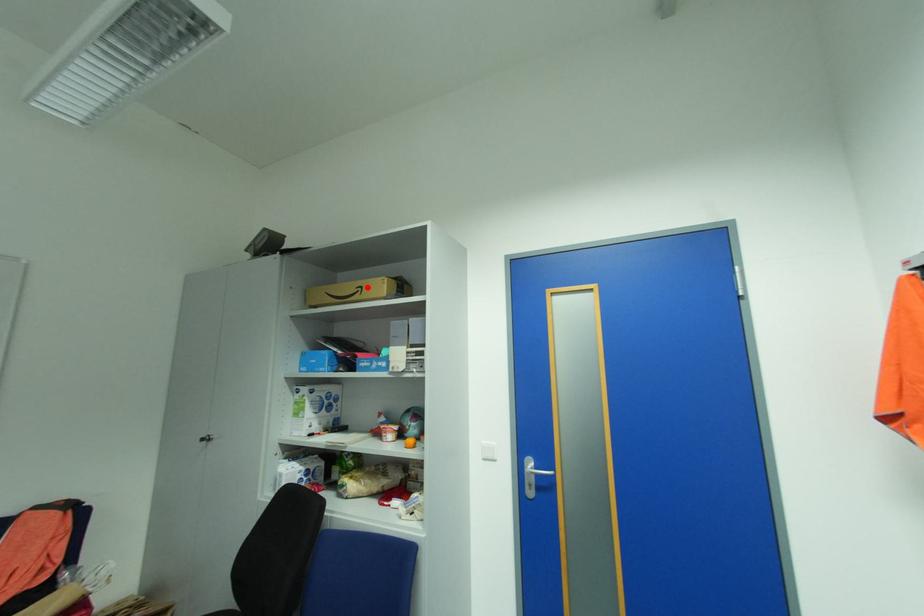
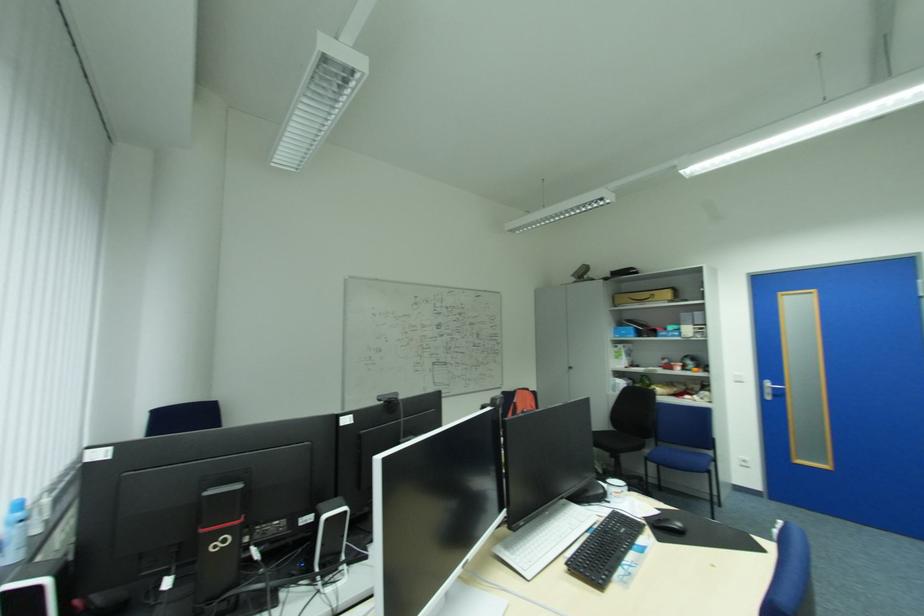
The point at the highlighted location is marked in the first image. Where is the corresponding point in the second image?

(659, 294)